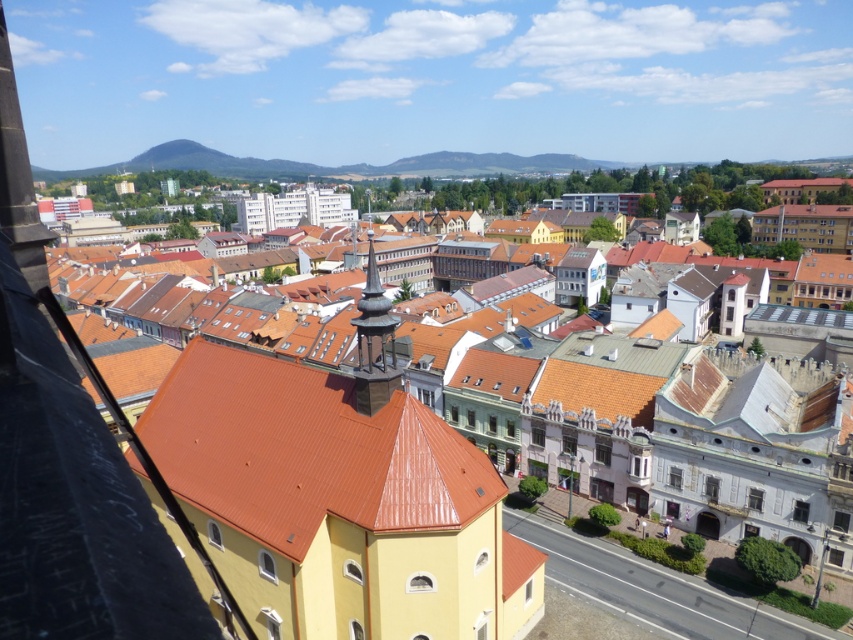
Does point (769, 374) lie behind point (357, 458)?

Yes.

The image size is (853, 640). What are the coordinates of `yellow matte church at center` in the screenshot? It's located at (762, 436).

Which is behind, point (543, 444) or point (384, 378)?

Positioned behind is point (543, 444).

Image resolution: width=853 pixels, height=640 pixels. What do you see at coordinates (762, 436) in the screenshot? I see `yellow matte church at center` at bounding box center [762, 436].

Find the location of a particular element. yellow matte church at center is located at coordinates (762, 436).

Is brown tile roof at center above shiny copper spire at center?

Actually, brown tile roof at center is below shiny copper spire at center.

Who is taller, brown tile roof at center or shiny copper spire at center?

With more height is shiny copper spire at center.

In order to click on brown tile roof at center in this screenshot , I will do `click(306, 451)`.